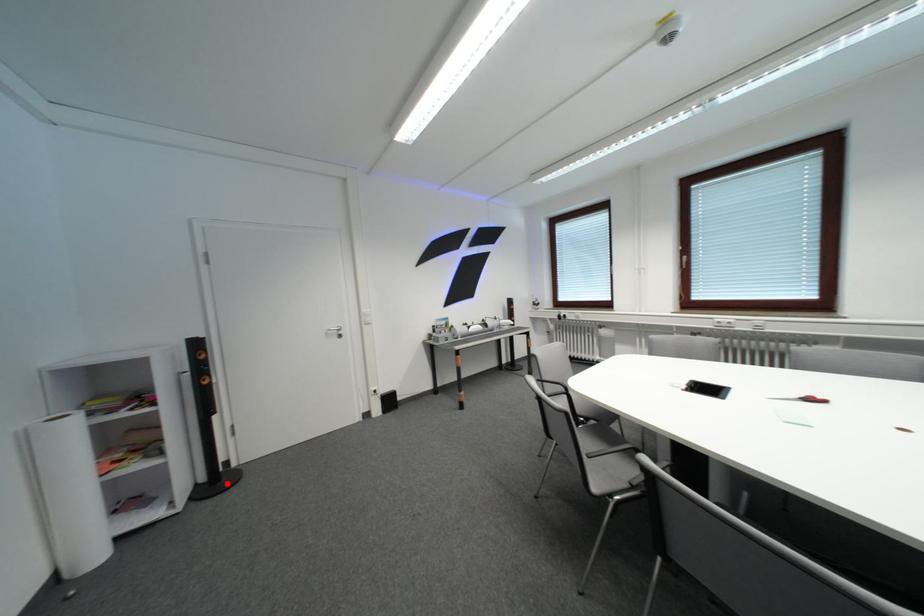
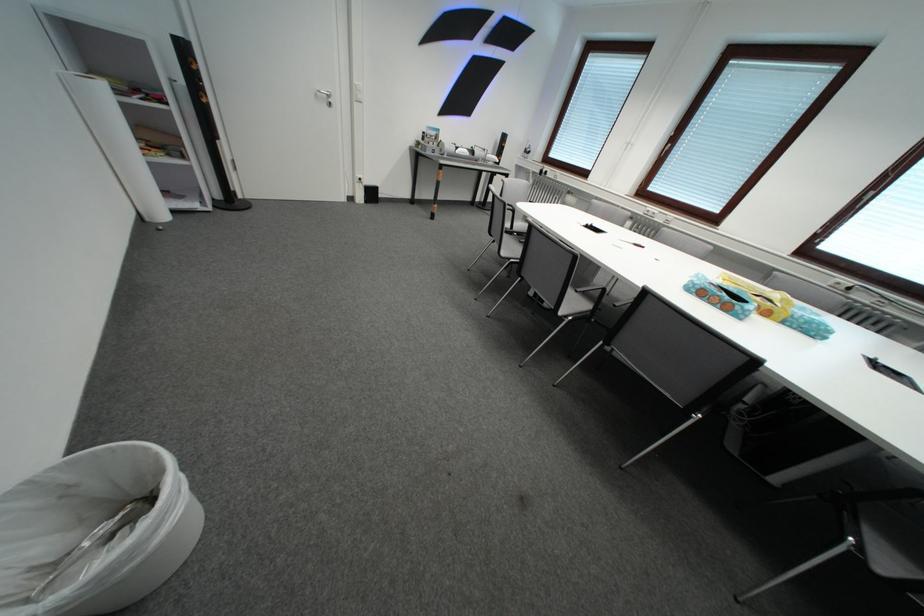
Locate, in the second image, the point that corresponds to the highlighted location in the first image.

(241, 205)